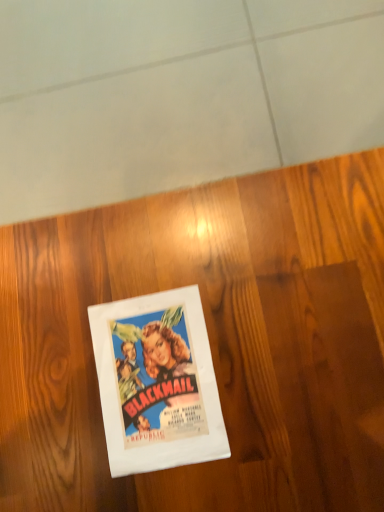
Find the location of a particular element. vacant space situated on the left part of white paper at center is located at coordinates (59, 425).